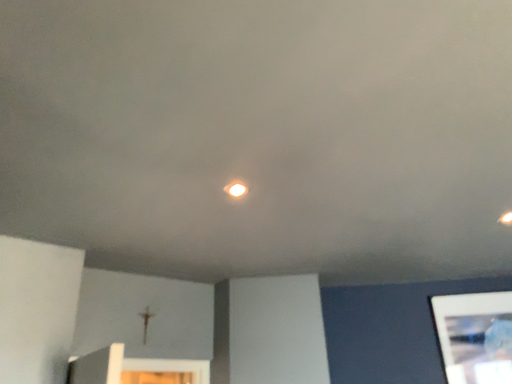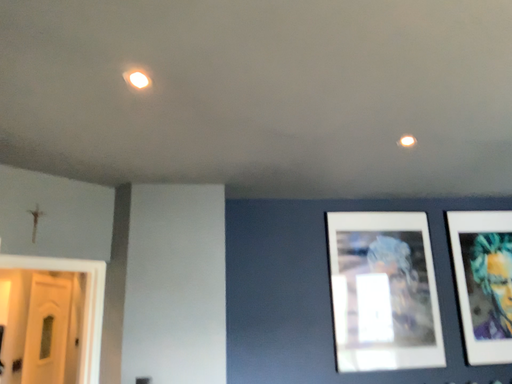
Question: Which way did the camera rotate in the video?

Choices:
 (A) rotated left
 (B) rotated right

Answer: (B)